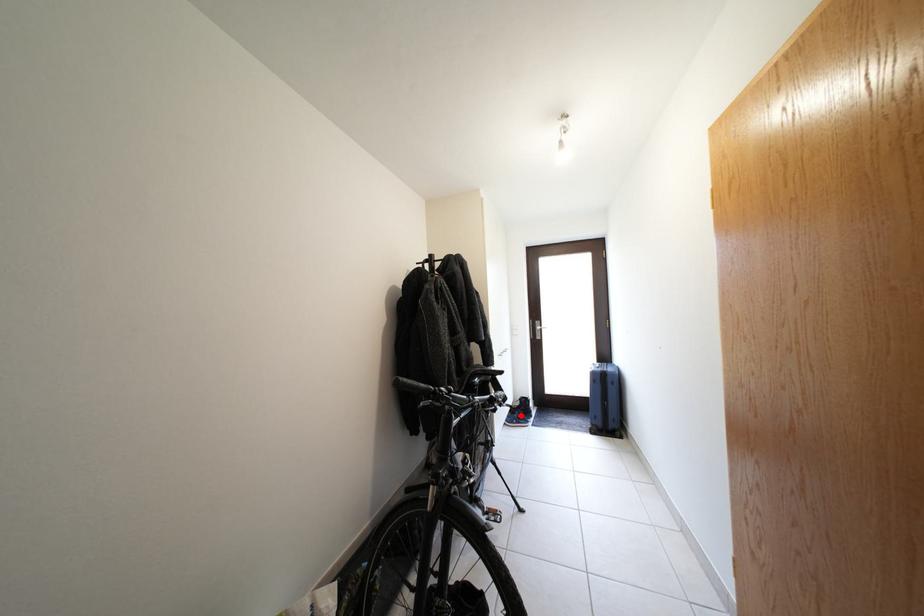
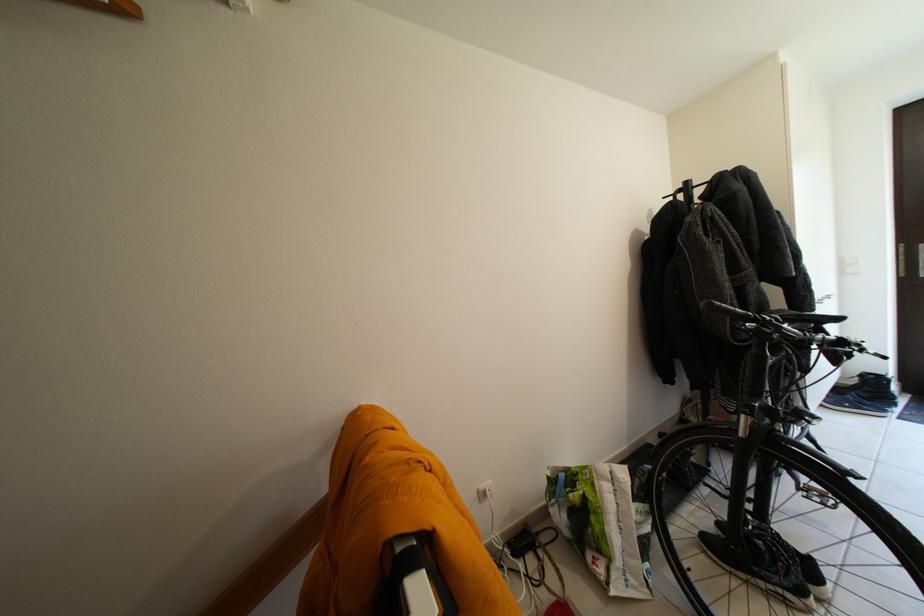
Question: I am providing you with two images of the same scene from different viewpoints. Image1 has a red point marked. In image2, the corresponding 3D location appears at what relative position? Reply with the corresponding letter.

Choices:
 (A) Closer
 (B) Farther

Answer: (A)